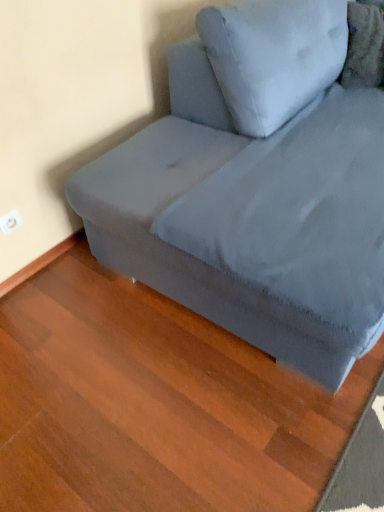
Question: Does velvet gray couch at upper right come behind velvety gray pillow at upper right?

Choices:
 (A) yes
 (B) no

Answer: (B)

Question: Is velvet gray couch at upper right taller than velvety gray pillow at upper right?

Choices:
 (A) yes
 (B) no

Answer: (A)

Question: Are velvet gray couch at upper right and velvety gray pillow at upper right making contact?

Choices:
 (A) yes
 (B) no

Answer: (B)

Question: Are velvet gray couch at upper right and velvety gray pillow at upper right located far from each other?

Choices:
 (A) no
 (B) yes

Answer: (A)

Question: Can you confirm if velvet gray couch at upper right is bigger than velvety gray pillow at upper right?

Choices:
 (A) no
 (B) yes

Answer: (B)

Question: Is velvety gray pillow at upper right completely or partially inside velvet gray couch at upper right?

Choices:
 (A) yes
 (B) no

Answer: (A)

Question: Is velvety gray pillow at upper right positioned behind velvet gray couch at upper right?

Choices:
 (A) yes
 (B) no

Answer: (A)

Question: Is velvety gray pillow at upper right in contact with velvet gray couch at upper right?

Choices:
 (A) yes
 (B) no

Answer: (B)

Question: Is velvety gray pillow at upper right at the right side of velvet gray couch at upper right?

Choices:
 (A) yes
 (B) no

Answer: (A)

Question: From a real-world perspective, is velvety gray pillow at upper right over velvet gray couch at upper right?

Choices:
 (A) yes
 (B) no

Answer: (A)

Question: From the image's perspective, would you say velvety gray pillow at upper right is shown under velvet gray couch at upper right?

Choices:
 (A) no
 (B) yes

Answer: (A)

Question: Is velvety gray pillow at upper right aimed at velvet gray couch at upper right?

Choices:
 (A) yes
 (B) no

Answer: (A)

Question: Which is correct: velvet gray couch at upper right is inside velvety gray pillow at upper right, or outside of it?

Choices:
 (A) inside
 (B) outside

Answer: (B)